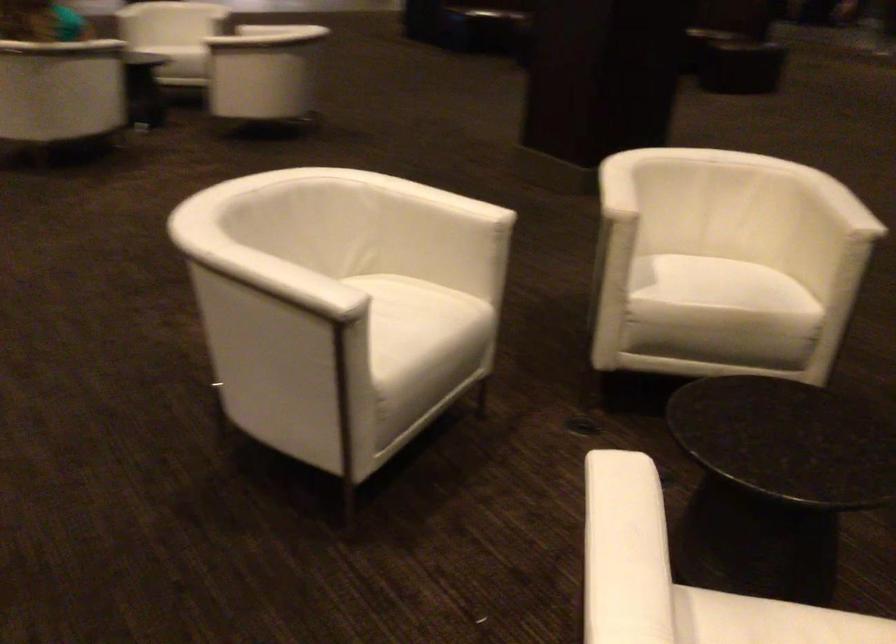
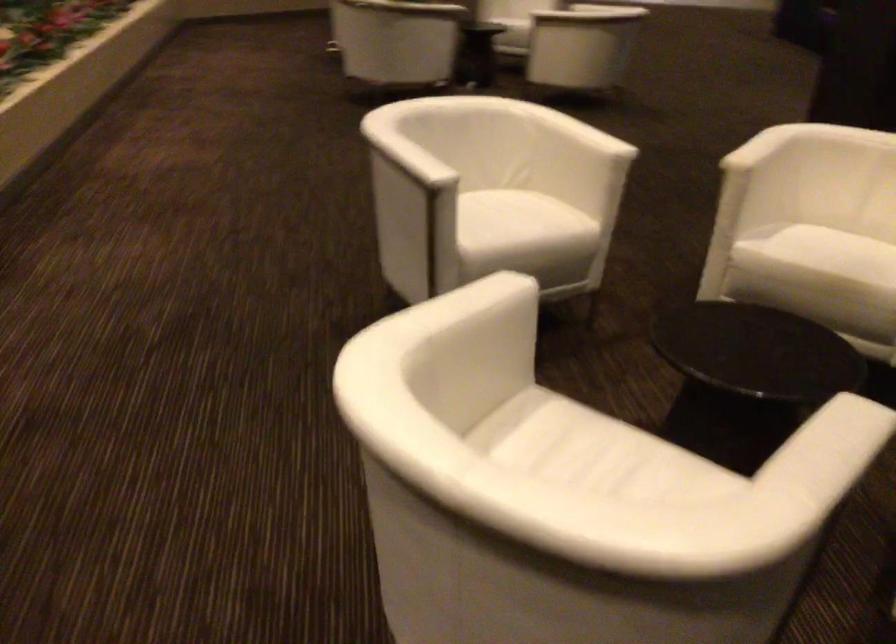
The point at (x=372, y=315) is marked in the first image. Where is the corresponding point in the second image?

(502, 214)